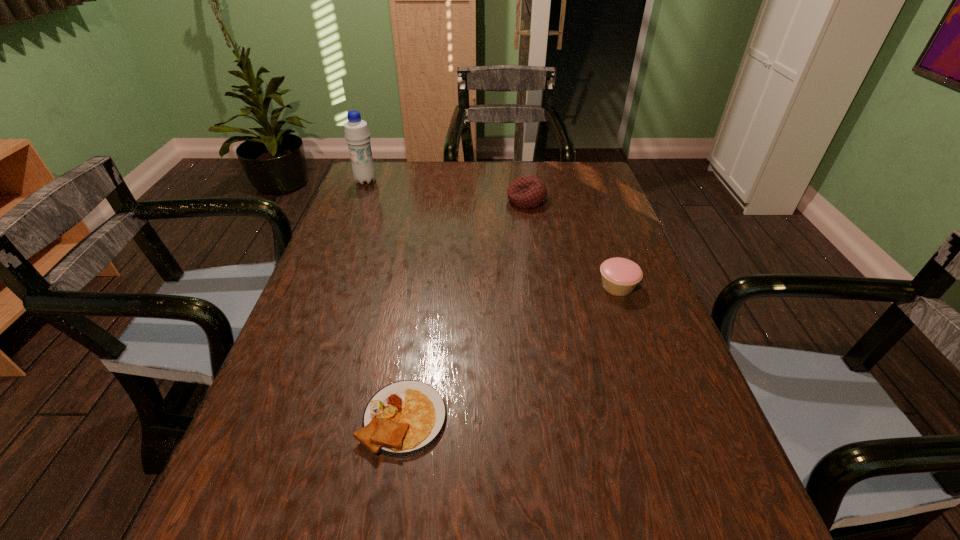
Identify the location of vacant space at the far left corner of the desktop. (398, 188).

Find the location of a particular element. vacant region between the cupcake and the shortest object is located at coordinates (511, 352).

I want to click on free area in between the leftmost object and the shortest object, so click(x=385, y=299).

Locate an element on the screen. The width and height of the screenshot is (960, 540). vacant space in between the omelet and the water bottle is located at coordinates (385, 299).

Image resolution: width=960 pixels, height=540 pixels. Identify the location of vacant area that lies between the tallest object and the nearest object. (385, 299).

Image resolution: width=960 pixels, height=540 pixels. Identify the location of vacant area that lies between the third tallest object and the second object from right to left. (572, 244).

At what (x,y) coordinates should I click in order to perform the action: click on empty space that is in between the third object from left to right and the tallest object. Please return your answer as a coordinate pair (x, y). Looking at the image, I should click on (446, 191).

What are the coordinates of `vacant space that's between the shortest object and the second object from right to left` in the screenshot? It's located at (465, 309).

Identify the location of empty space between the farthest object and the cupcake. This screenshot has width=960, height=540. (492, 233).

I want to click on free space that is in between the third nearest object and the farthest object, so click(x=446, y=191).